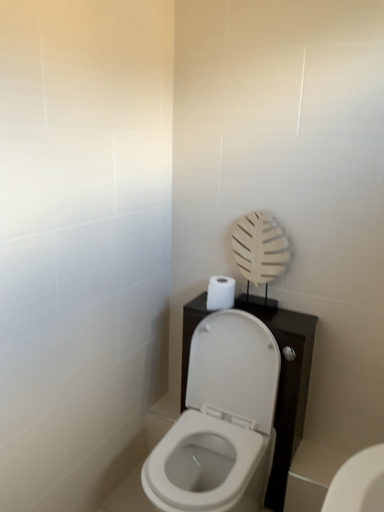
Question: Is white glossy toilet at lower right, the 2th toilet positioned from the top, to the left of white matte toilet paper at upper right from the viewer's perspective?

Choices:
 (A) no
 (B) yes

Answer: (A)

Question: Considering the relative positions of white glossy toilet at lower right, positioned as the 2th toilet in left-to-right order, and white matte toilet paper at upper right in the image provided, is white glossy toilet at lower right, positioned as the 2th toilet in left-to-right order, to the right of white matte toilet paper at upper right from the viewer's perspective?

Choices:
 (A) no
 (B) yes

Answer: (B)

Question: Is white glossy toilet at lower right, arranged as the first toilet when ordered from the bottom, facing away from white matte toilet paper at upper right?

Choices:
 (A) no
 (B) yes

Answer: (A)

Question: Can you confirm if white glossy toilet at lower right, the first toilet when ordered from right to left, is thinner than white matte toilet paper at upper right?

Choices:
 (A) no
 (B) yes

Answer: (A)

Question: Is white glossy toilet at lower right, arranged as the first toilet when ordered from the bottom, not close to white matte toilet paper at upper right?

Choices:
 (A) yes
 (B) no

Answer: (B)

Question: Is white glossy toilet at center, which ranks as the first toilet in left-to-right order, wider or thinner than white matte toilet paper at upper right?

Choices:
 (A) wide
 (B) thin

Answer: (A)

Question: From the image's perspective, is white glossy toilet at center, which ranks as the first toilet in left-to-right order, positioned above or below white matte toilet paper at upper right?

Choices:
 (A) below
 (B) above

Answer: (A)

Question: Visually, is white glossy toilet at center, positioned as the 2th toilet in right-to-left order, positioned to the left or to the right of white matte toilet paper at upper right?

Choices:
 (A) right
 (B) left

Answer: (B)

Question: Considering their positions, is white glossy toilet at center, positioned as the 2th toilet in right-to-left order, located in front of or behind white matte toilet paper at upper right?

Choices:
 (A) front
 (B) behind

Answer: (A)

Question: From a real-world perspective, is white glossy toilet at center, placed as the first toilet when sorted from top to bottom, above or below white glossy toilet at lower right, the 2th toilet positioned from the top?

Choices:
 (A) above
 (B) below

Answer: (A)

Question: Looking at their shapes, would you say white glossy toilet at center, the second toilet positioned from the bottom, is wider or thinner than white glossy toilet at lower right, positioned as the 2th toilet in left-to-right order?

Choices:
 (A) thin
 (B) wide

Answer: (B)

Question: From the image's perspective, relative to white glossy toilet at lower right, the first toilet when ordered from right to left, is white glossy toilet at center, placed as the first toilet when sorted from top to bottom, above or below?

Choices:
 (A) above
 (B) below

Answer: (A)

Question: Based on their positions, is white glossy toilet at center, which ranks as the first toilet in left-to-right order, located to the left or right of white glossy toilet at lower right, the first toilet when ordered from right to left?

Choices:
 (A) right
 (B) left

Answer: (B)

Question: From the image's perspective, is white matte toilet paper at upper right positioned above or below white glossy toilet at center, the second toilet positioned from the bottom?

Choices:
 (A) above
 (B) below

Answer: (A)

Question: Based on their positions, is white matte toilet paper at upper right located to the left or right of white glossy toilet at center, positioned as the 2th toilet in right-to-left order?

Choices:
 (A) left
 (B) right

Answer: (B)